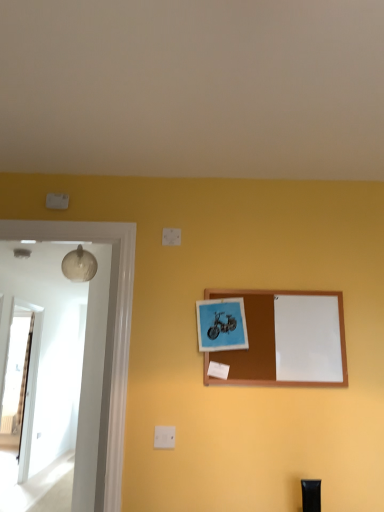
Measure the distance between point (313,489) and camera.

The depth of point (313,489) is 1.69 meters.

At what (x,y) coordinates should I click in order to perform the action: click on black plastic tube at lower right. Please return your answer as a coordinate pair (x, y). Looking at the image, I should click on (311, 495).

Where is `transparent glass door at left`? transparent glass door at left is located at coordinates [20, 381].

Which of these two, wooden corkboard at center, which ranks as the 1th picture frame in right-to-left order, or matte blue picture frame at center, which is the 1th picture frame from left to right, stands taller?

wooden corkboard at center, which ranks as the 1th picture frame in right-to-left order, is taller.

Is wooden corkboard at center, which ranks as the 1th picture frame in right-to-left order, directly adjacent to matte blue picture frame at center, the 2th picture frame when ordered from right to left?

No, wooden corkboard at center, which ranks as the 1th picture frame in right-to-left order, is not with matte blue picture frame at center, the 2th picture frame when ordered from right to left.

Based on the photo, which object is further away from the camera, wooden corkboard at center, the 2th picture frame in the left-to-right sequence, or matte blue picture frame at center, which is the 1th picture frame from left to right?

wooden corkboard at center, the 2th picture frame in the left-to-right sequence.

Is wooden corkboard at center, which ranks as the 1th picture frame in right-to-left order, facing towards matte blue picture frame at center, which is the 1th picture frame from left to right?

Yes, wooden corkboard at center, which ranks as the 1th picture frame in right-to-left order, is facing matte blue picture frame at center, which is the 1th picture frame from left to right.

Between matte blue picture frame at center, the 2th picture frame when ordered from right to left, and wooden corkboard at center, the 2th picture frame in the left-to-right sequence, which one is positioned behind?

wooden corkboard at center, the 2th picture frame in the left-to-right sequence, is behind.

Is matte blue picture frame at center, the 2th picture frame when ordered from right to left, shorter than wooden corkboard at center, the 2th picture frame in the left-to-right sequence?

Yes.

Can you tell me how much matte blue picture frame at center, the 2th picture frame when ordered from right to left, and wooden corkboard at center, which ranks as the 1th picture frame in right-to-left order, differ in facing direction?

The angle between the facing direction of matte blue picture frame at center, the 2th picture frame when ordered from right to left, and the facing direction of wooden corkboard at center, which ranks as the 1th picture frame in right-to-left order, is 0.0138 degrees.

Which of these two, black plastic tube at lower right or transparent glass door at left, is thinner?

Thinner between the two is black plastic tube at lower right.

Is black plastic tube at lower right next to transparent glass door at left and touching it?

Result: No, black plastic tube at lower right is not beside transparent glass door at left.

From the image's perspective, is black plastic tube at lower right below transparent glass door at left?

No.

Is black plastic tube at lower right positioned with its back to transparent glass door at left?

No, black plastic tube at lower right is not facing away from transparent glass door at left.

Does matte blue picture frame at center, which is the 1th picture frame from left to right, turn towards black plastic tube at lower right?

No, matte blue picture frame at center, which is the 1th picture frame from left to right, is not turned towards black plastic tube at lower right.

Is matte blue picture frame at center, which is the 1th picture frame from left to right, shorter than black plastic tube at lower right?

Incorrect, the height of matte blue picture frame at center, which is the 1th picture frame from left to right, does not fall short of that of black plastic tube at lower right.

Is matte blue picture frame at center, the 2th picture frame when ordered from right to left, not inside black plastic tube at lower right?

Yes, matte blue picture frame at center, the 2th picture frame when ordered from right to left, is outside of black plastic tube at lower right.

Are matte blue picture frame at center, the 2th picture frame when ordered from right to left, and black plastic tube at lower right making contact?

No, matte blue picture frame at center, the 2th picture frame when ordered from right to left, is not making contact with black plastic tube at lower right.

Considering the relative positions of matte blue picture frame at center, which is the 1th picture frame from left to right, and transparent glass door at left in the image provided, is matte blue picture frame at center, which is the 1th picture frame from left to right, to the right of transparent glass door at left from the viewer's perspective?

Indeed, matte blue picture frame at center, which is the 1th picture frame from left to right, is positioned on the right side of transparent glass door at left.

Is matte blue picture frame at center, which is the 1th picture frame from left to right, inside the boundaries of transparent glass door at left, or outside?

matte blue picture frame at center, which is the 1th picture frame from left to right, is spatially situated outside transparent glass door at left.

How much distance is there between matte blue picture frame at center, which is the 1th picture frame from left to right, and transparent glass door at left?

matte blue picture frame at center, which is the 1th picture frame from left to right, and transparent glass door at left are 3.28 meters apart from each other.

From the image's perspective, which is above, transparent glass door at left or black plastic tube at lower right?

From the image's view, black plastic tube at lower right is above.

Looking at this image, from a real-world perspective, is transparent glass door at left above or below black plastic tube at lower right?

In terms of real-world spatial position, transparent glass door at left is above black plastic tube at lower right.

What's the angular difference between transparent glass door at left and black plastic tube at lower right's facing directions?

They differ by 89.8 degrees in their facing directions.

How far apart are transparent glass door at left and black plastic tube at lower right?

transparent glass door at left is 3.51 meters from black plastic tube at lower right.

From the image's perspective, which one is positioned higher, transparent glass door at left or wooden corkboard at center, which ranks as the 1th picture frame in right-to-left order?

wooden corkboard at center, which ranks as the 1th picture frame in right-to-left order, is shown above in the image.

From a real-world perspective, which is physically below, transparent glass door at left or wooden corkboard at center, which ranks as the 1th picture frame in right-to-left order?

transparent glass door at left, from a real-world perspective.

Can you tell me how much transparent glass door at left and wooden corkboard at center, the 2th picture frame in the left-to-right sequence, differ in facing direction?

They differ by 88.8 degrees in their facing directions.

The image size is (384, 512). Find the location of `picture frame directly beneath the matte blue picture frame at center, the 2th picture frame when ordered from right to left (from a real-world perspective)`. picture frame directly beneath the matte blue picture frame at center, the 2th picture frame when ordered from right to left (from a real-world perspective) is located at coordinates (286, 339).

This screenshot has width=384, height=512. What are the coordinates of `picture frame on the right of the matte blue picture frame at center, which is the 1th picture frame from left to right` in the screenshot? It's located at (286, 339).

When comparing their distances from wooden corkboard at center, the 2th picture frame in the left-to-right sequence, does transparent glass door at left or black plastic tube at lower right seem closer?

Among the two, black plastic tube at lower right is located nearer to wooden corkboard at center, the 2th picture frame in the left-to-right sequence.

In the scene shown: Estimate the real-world distances between objects in this image. Which object is further from matte blue picture frame at center, the 2th picture frame when ordered from right to left, black plastic tube at lower right or transparent glass door at left?

transparent glass door at left lies further to matte blue picture frame at center, the 2th picture frame when ordered from right to left, than the other object.

Based on the photo, which object lies nearer to the anchor point matte blue picture frame at center, the 2th picture frame when ordered from right to left, transparent glass door at left or black plastic tube at lower right?

black plastic tube at lower right is positioned closer to the anchor matte blue picture frame at center, the 2th picture frame when ordered from right to left.

From the image, which object appears to be farther from matte blue picture frame at center, the 2th picture frame when ordered from right to left, wooden corkboard at center, the 2th picture frame in the left-to-right sequence, or transparent glass door at left?

The object further to matte blue picture frame at center, the 2th picture frame when ordered from right to left, is transparent glass door at left.

Estimate the real-world distances between objects in this image. Which object is closer to black plastic tube at lower right, transparent glass door at left or matte blue picture frame at center, which is the 1th picture frame from left to right?

matte blue picture frame at center, which is the 1th picture frame from left to right, is positioned closer to the anchor black plastic tube at lower right.

Based on their spatial positions, is transparent glass door at left or wooden corkboard at center, which ranks as the 1th picture frame in right-to-left order, closer to black plastic tube at lower right?

The object closer to black plastic tube at lower right is wooden corkboard at center, which ranks as the 1th picture frame in right-to-left order.

Considering their positions, is black plastic tube at lower right positioned closer to wooden corkboard at center, the 2th picture frame in the left-to-right sequence, than matte blue picture frame at center, the 2th picture frame when ordered from right to left?

matte blue picture frame at center, the 2th picture frame when ordered from right to left, is positioned closer to the anchor wooden corkboard at center, the 2th picture frame in the left-to-right sequence.

When comparing their distances from black plastic tube at lower right, does wooden corkboard at center, which ranks as the 1th picture frame in right-to-left order, or transparent glass door at left seem further?

transparent glass door at left is positioned further to the anchor black plastic tube at lower right.

Find the location of a particular element. The height and width of the screenshot is (512, 384). picture frame between matte blue picture frame at center, which is the 1th picture frame from left to right, and transparent glass door at left in the front-back direction is located at coordinates click(286, 339).

Find the location of a particular element. The width and height of the screenshot is (384, 512). picture frame between matte blue picture frame at center, which is the 1th picture frame from left to right, and black plastic tube at lower right, in the vertical direction is located at coordinates (286, 339).